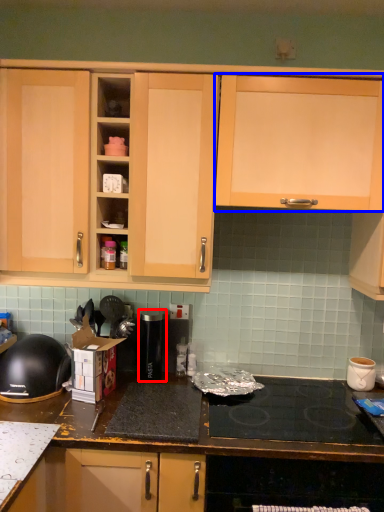
Question: Which object appears farthest to the camera in this image, appliance (highlighted by a red box) or cabinetry (highlighted by a blue box)?

Choices:
 (A) appliance
 (B) cabinetry

Answer: (A)